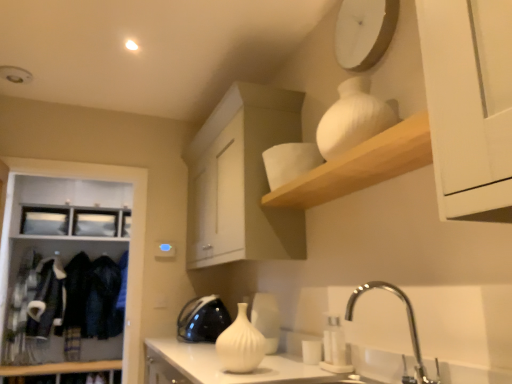
Question: Looking at their shapes, would you say polished chrome faucet at lower right is wider or thinner than white matte clock at upper center?

Choices:
 (A) thin
 (B) wide

Answer: (B)

Question: Does point (391, 286) appear closer or farther from the camera than point (370, 56)?

Choices:
 (A) farther
 (B) closer

Answer: (B)

Question: Estimate the real-world distances between objects in this image. Which object is farther from the white matte vase at upper center?

Choices:
 (A) white ribbed vase at center, the 1th glass vase from the left
 (B) white matte cabinet at upper center, the second cabinetry from the left
 (C) white wood cabinet at left, which ranks as the 2th cabinetry in front-to-back order
 (D) white glossy vase at center, marked as the 1th appliance in a front-to-back arrangement
 (E) polished chrome faucet at lower right

Answer: (C)

Question: Considering the real-world distances, which object is farthest from the white ribbed vase at upper right, which is the 2th glass vase from left to right?

Choices:
 (A) black glossy kettle at center, which is the 1th appliance in left-to-right order
 (B) polished chrome faucet at lower right
 (C) fuzzy black jacket at left
 (D) white wood cabinet at left, which ranks as the 2th cabinetry in front-to-back order
 (E) white glossy vase at center

Answer: (C)